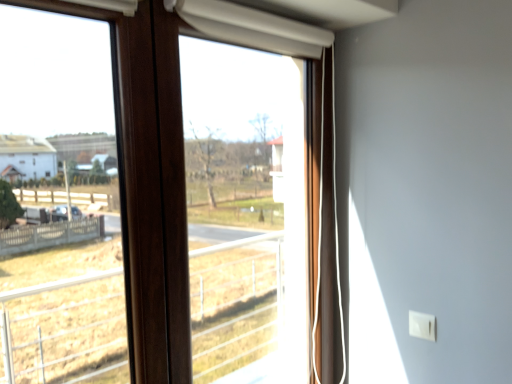
Question: From the image's perspective, is wooden frame at center located above or below transparent plastic window screen at center?

Choices:
 (A) below
 (B) above

Answer: (A)

Question: Is point (119, 99) positioned closer to the camera than point (292, 200)?

Choices:
 (A) closer
 (B) farther

Answer: (A)

Question: Visually, is wooden frame at center positioned to the left or to the right of transparent plastic window screen at center?

Choices:
 (A) right
 (B) left

Answer: (B)

Question: From their relative heights in the image, would you say transparent plastic window screen at center is taller or shorter than wooden frame at center?

Choices:
 (A) short
 (B) tall

Answer: (A)

Question: Is transparent plastic window screen at center bigger or smaller than wooden frame at center?

Choices:
 (A) small
 (B) big

Answer: (A)

Question: From the image's perspective, is transparent plastic window screen at center located above or below wooden frame at center?

Choices:
 (A) below
 (B) above

Answer: (B)

Question: Would you say transparent plastic window screen at center is to the left or to the right of wooden frame at center in the picture?

Choices:
 (A) right
 (B) left

Answer: (A)